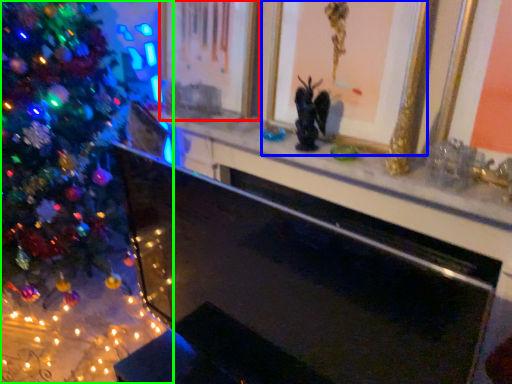
Question: Which object is positioned closest to picture frame (highlighted by a red box)? Select from picture frame (highlighted by a blue box) and christmas tree (highlighted by a green box).

Choices:
 (A) picture frame
 (B) christmas tree

Answer: (A)